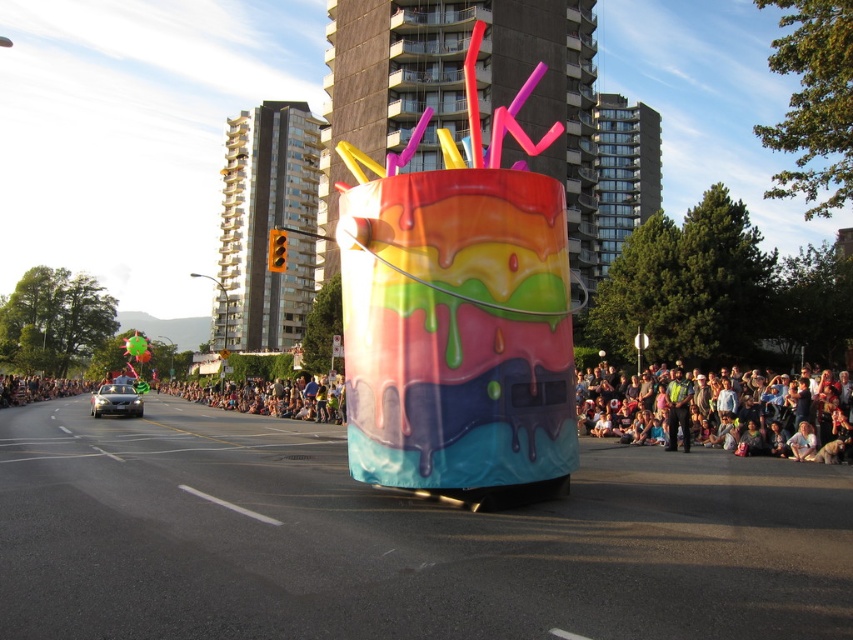
Can you confirm if matte black crowd at lower right is smaller than shiny black car at left?

Yes.

Which is behind, point (837, 388) or point (102, 410)?

Point (102, 410)

The width and height of the screenshot is (853, 640). I want to click on matte black crowd at lower right, so click(741, 424).